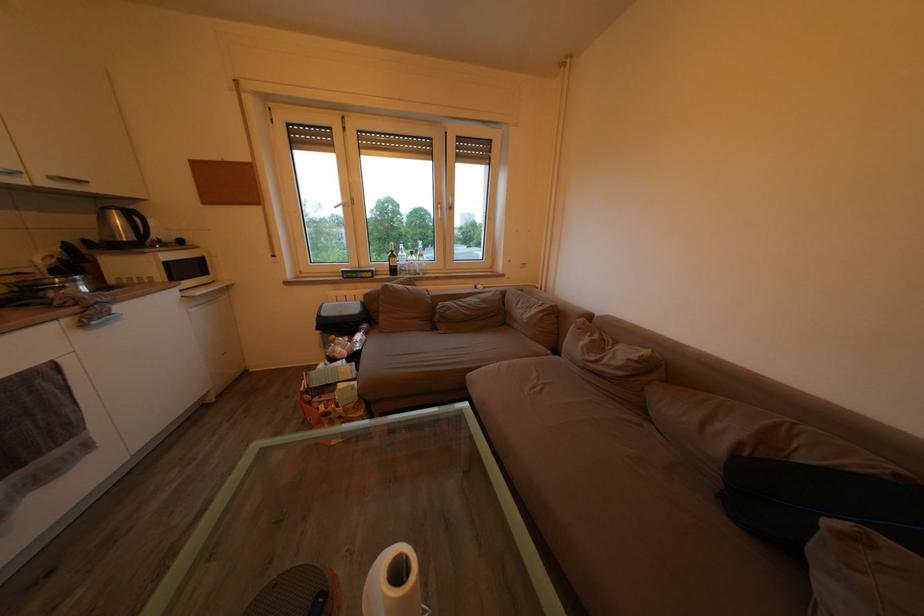
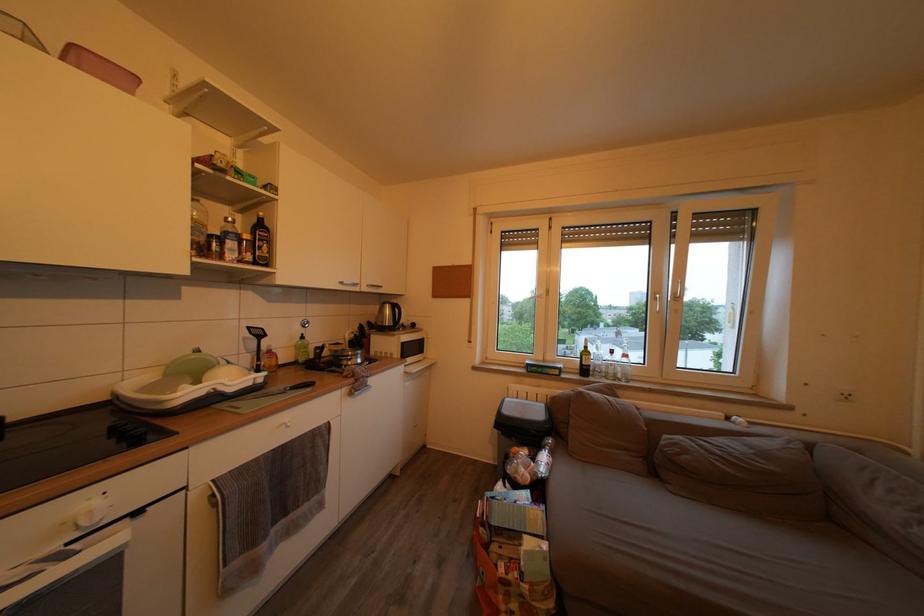
The point at (x=435, y=371) is marked in the first image. Where is the corresponding point in the second image?

(685, 580)